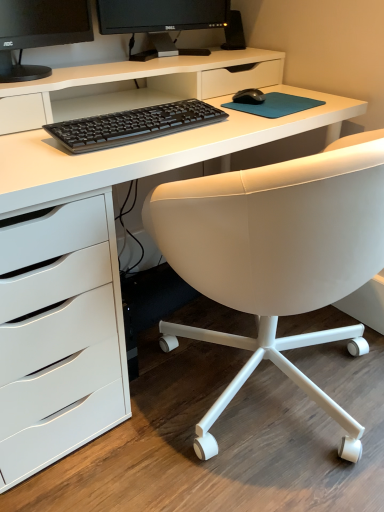
Where is `free point below white leather chair at center (from a real-world perspective)`? This screenshot has width=384, height=512. free point below white leather chair at center (from a real-world perspective) is located at coordinates (296, 395).